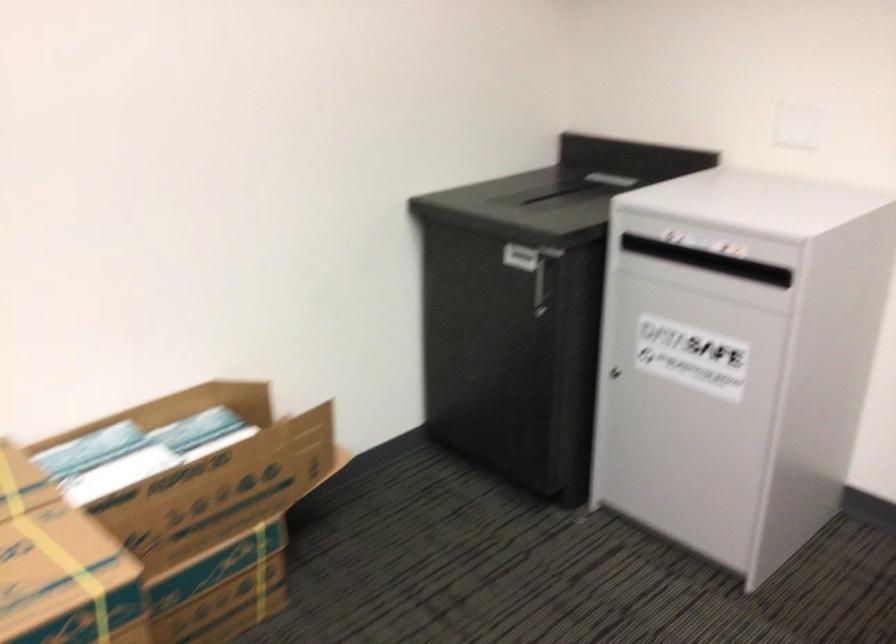
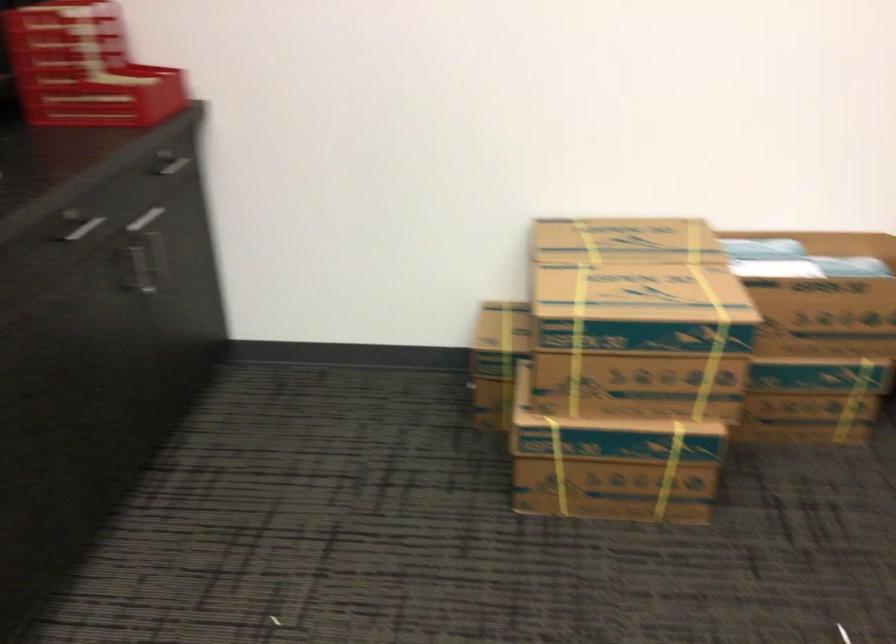
Where in the second image is the point corresponding to point (202, 471) from the first image?

(828, 286)